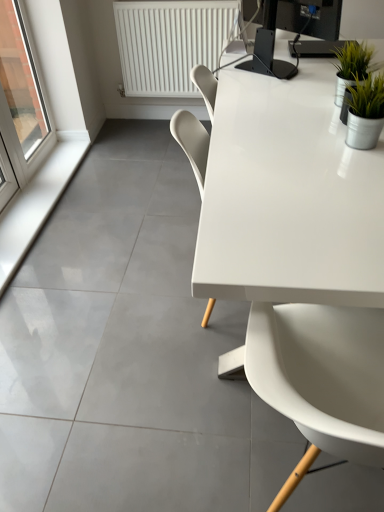
Identify the location of blank space above white smooth window sill at lower left (from a real-world perspective). (31, 193).